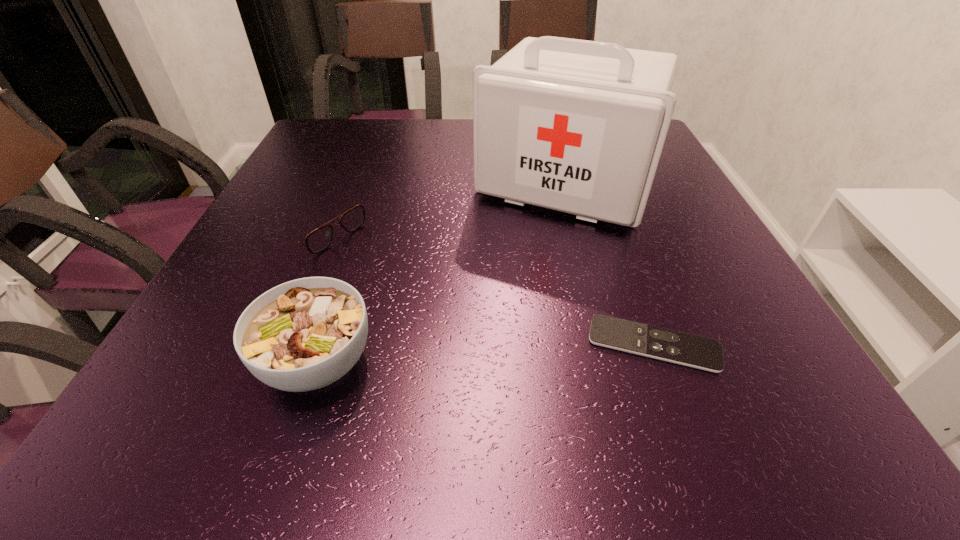
In order to click on soup bowl in this screenshot , I will do `click(302, 335)`.

The height and width of the screenshot is (540, 960). Find the location of `the shortest object`. the shortest object is located at coordinates (704, 353).

Find the location of a particular element. Image resolution: width=960 pixels, height=540 pixels. the second shortest object is located at coordinates (318, 240).

I want to click on the first-aid kit, so click(577, 126).

You are a GUI agent. You are given a task and a screenshot of the screen. Output one action in this format:
    pyautogui.click(x=<x>, y=<y>)
    Task: Click on the vacant space located 0.130m on the left of the soup bowl
    
    Given the screenshot: What is the action you would take?
    pyautogui.click(x=177, y=362)

You are a GUI agent. You are given a task and a screenshot of the screen. Output one action in this format:
    pyautogui.click(x=<x>, y=<y>)
    Task: Click on the vacant space positioned 0.400m on the back of the remote control
    The image size is (960, 540).
    Given the screenshot: What is the action you would take?
    pyautogui.click(x=598, y=191)

This screenshot has width=960, height=540. In order to click on free space located 0.200m on the front-facing side of the sunglasses in this screenshot , I will do `click(422, 287)`.

At what (x,y) coordinates should I click in order to perform the action: click on free space located on the front-facing side of the sunglasses. Please return your answer as a coordinate pair (x, y). Image resolution: width=960 pixels, height=540 pixels. Looking at the image, I should click on (515, 338).

I want to click on free space located on the front-facing side of the sunglasses, so click(367, 255).

Where is `free space located on the front-facing side of the first-aid kit`? Image resolution: width=960 pixels, height=540 pixels. free space located on the front-facing side of the first-aid kit is located at coordinates (472, 346).